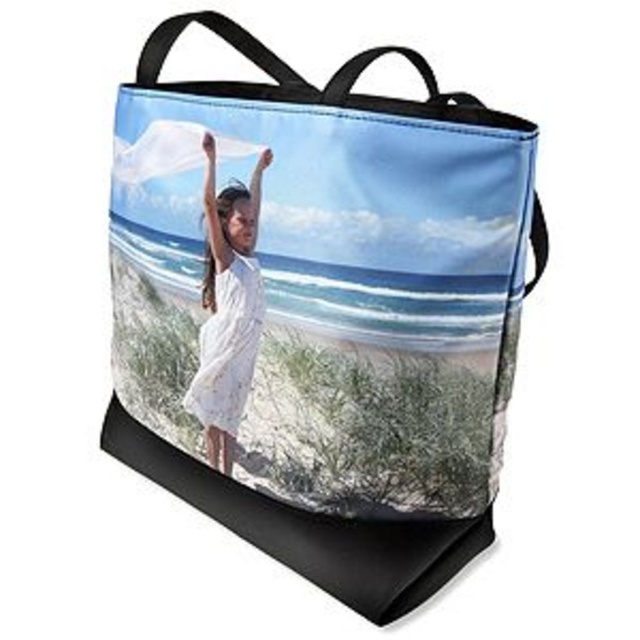
Which of these two, matte fabric tote bag at center or white cotton dress at center, stands taller?

matte fabric tote bag at center

Does matte fabric tote bag at center have a larger size compared to white cotton dress at center?

Indeed, matte fabric tote bag at center has a larger size compared to white cotton dress at center.

Between point (419, 596) and point (241, 404), which one is positioned behind?

Point (241, 404)

At what (x,y) coordinates should I click in order to perform the action: click on matte fabric tote bag at center. Please return your answer as a coordinate pair (x, y). Looking at the image, I should click on (310, 529).

Is white cotton dress at center smaller than white lace dress at center?

Incorrect, white cotton dress at center is not smaller in size than white lace dress at center.

Which is above, white cotton dress at center or white lace dress at center?

Positioned higher is white cotton dress at center.

Find the location of a particular element. This screenshot has width=640, height=640. white cotton dress at center is located at coordinates (227, 308).

In the scene shown: Who is positioned more to the left, matte fabric tote bag at center or white lace dress at center?

white lace dress at center

Between point (344, 68) and point (218, 404), which one is positioned behind?

The point (218, 404) is behind.

You are a GUI agent. You are given a task and a screenshot of the screen. Output one action in this format:
    pyautogui.click(x=<x>, y=<y>)
    Task: Click on the matte fabric tote bag at center
    The height and width of the screenshot is (640, 640).
    Given the screenshot: What is the action you would take?
    (310, 529)